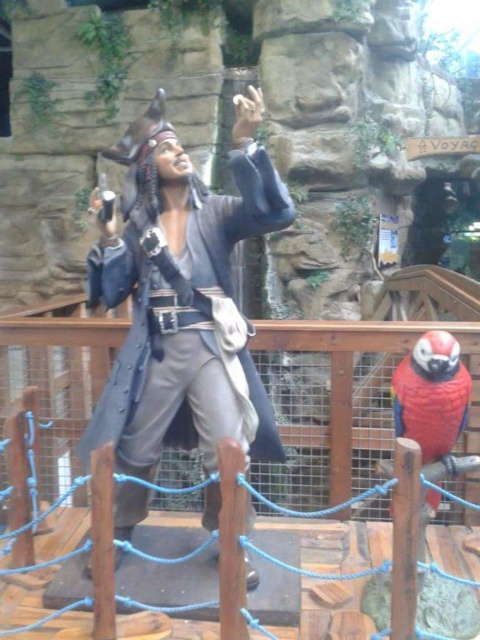
Question: Observing the image, what is the correct spatial positioning of matte black pirate at center in reference to shiny red parrot at lower right?

Choices:
 (A) above
 (B) below

Answer: (A)

Question: Which of the following is the farthest from the observer?

Choices:
 (A) (463, 387)
 (B) (189, 364)

Answer: (A)

Question: Which point appears farthest from the camera in this image?

Choices:
 (A) (244, 436)
 (B) (420, 458)

Answer: (A)

Question: Does matte black pirate at center appear under shiny red parrot at lower right?

Choices:
 (A) no
 (B) yes

Answer: (A)

Question: Is matte black pirate at center thinner than shiny red parrot at lower right?

Choices:
 (A) no
 (B) yes

Answer: (A)

Question: Which of the following is the farthest from the observer?

Choices:
 (A) shiny red parrot at lower right
 (B) matte black pirate at center

Answer: (A)